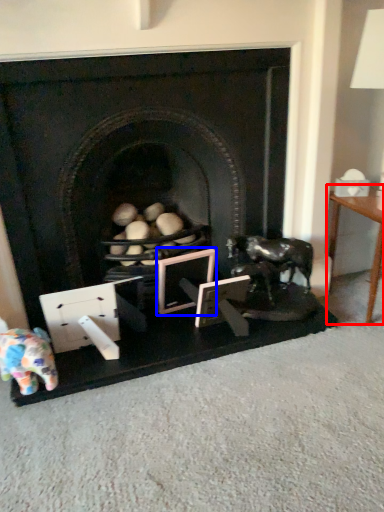
Question: Which point is further to the camera, table (highlighted by a red box) or picture frame (highlighted by a blue box)?

Choices:
 (A) table
 (B) picture frame

Answer: (B)